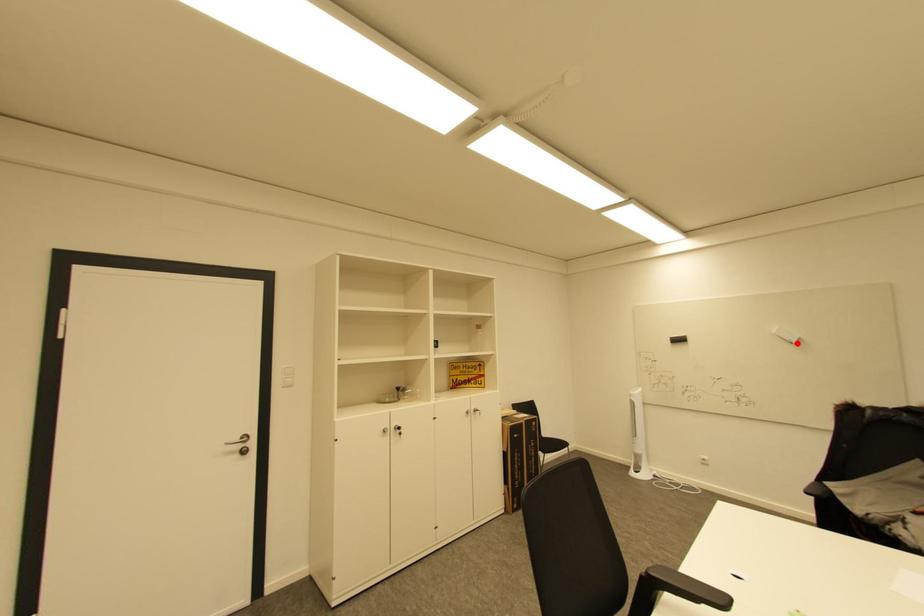
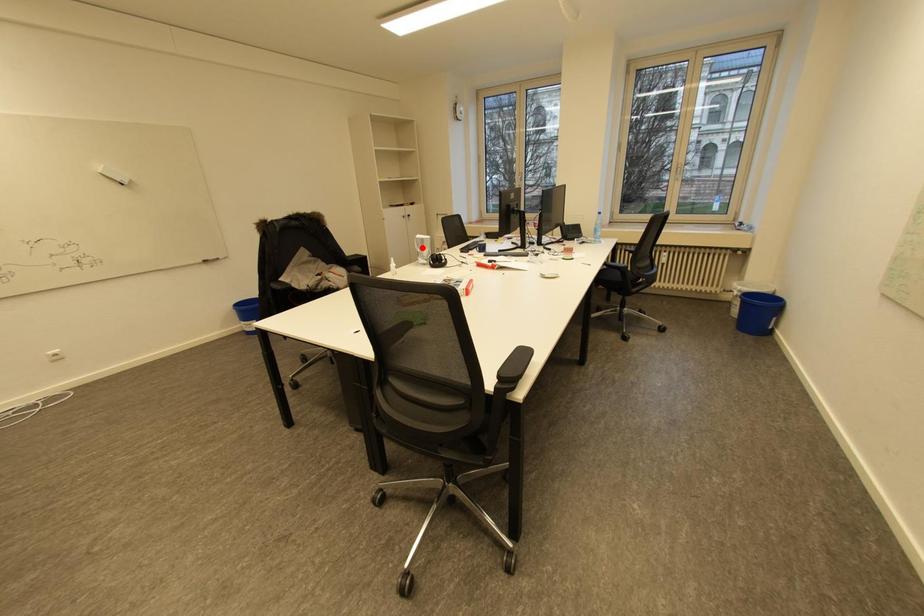
I am providing you with two images of the same scene from different viewpoints. A red point is marked on the first image and another point is marked on the second image. Are the points marked in image1 and image2 representing the same 3D position?

No